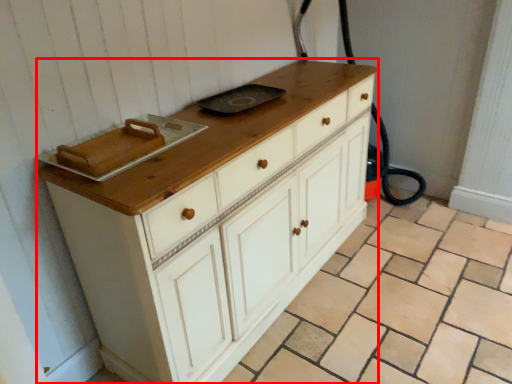
Question: Where is chest of drawers (annotated by the red box) located in relation to tile in the image?

Choices:
 (A) left
 (B) right

Answer: (A)